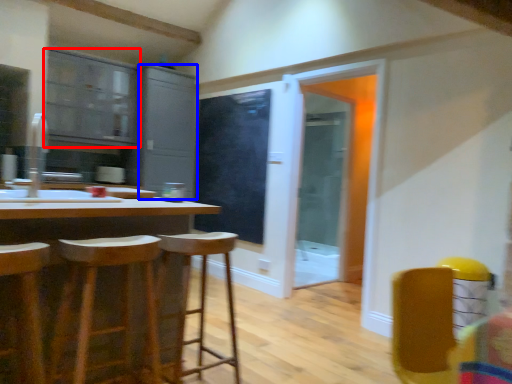
Question: Which of the following is the closest to the observer, cabinetry (highlighted by a red box) or cabinetry (highlighted by a blue box)?

Choices:
 (A) cabinetry
 (B) cabinetry

Answer: (A)